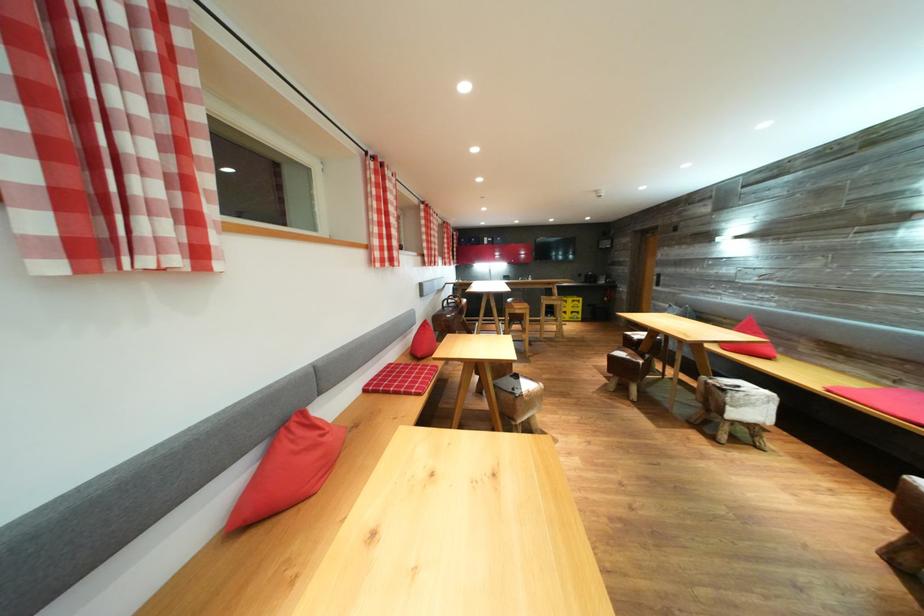
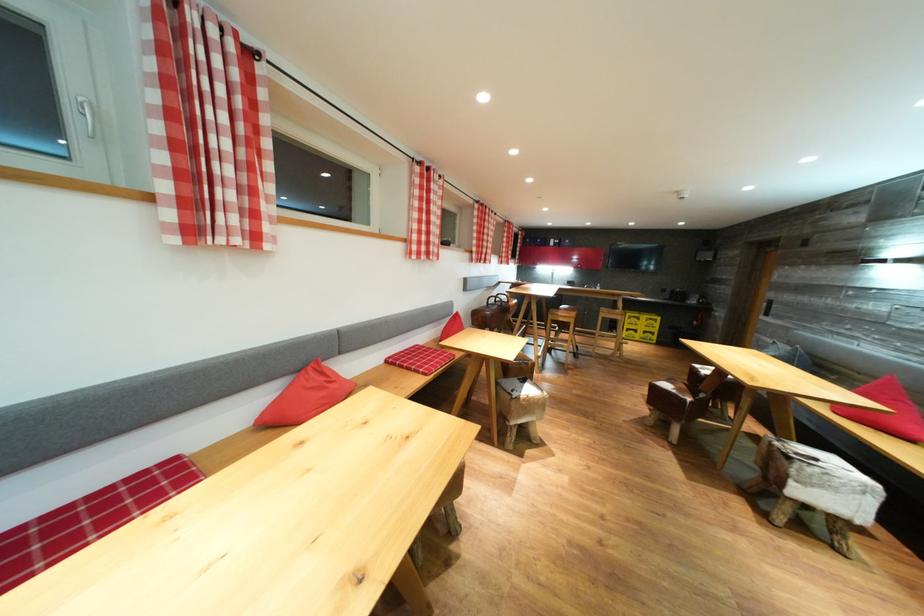
Where in the second image is the point corresponding to (x=577, y=305) from the first image?

(650, 323)